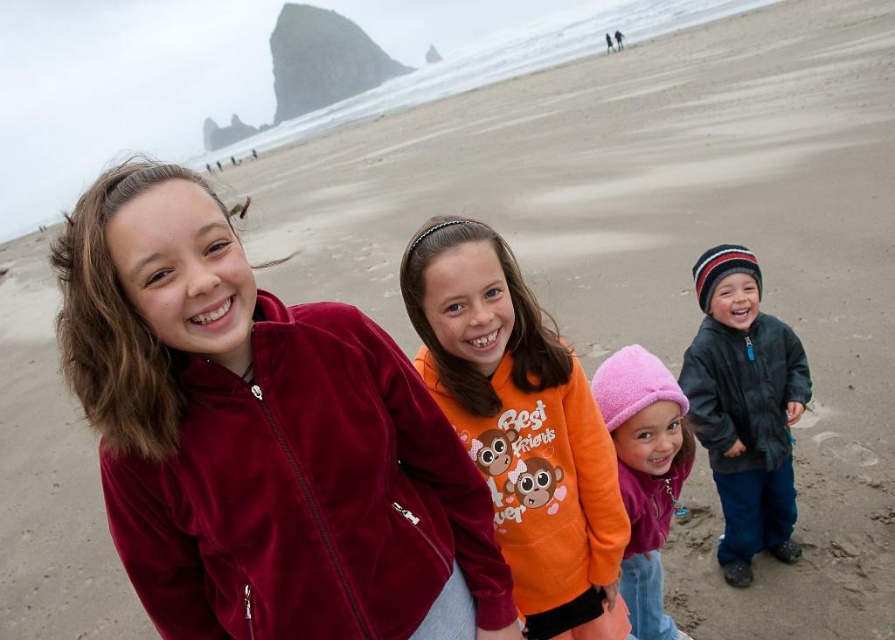
Question: Observing the image, what is the correct spatial positioning of orange fleece sweatshirt at center in reference to pink fleece hat at center?

Choices:
 (A) left
 (B) right

Answer: (A)

Question: Which object is farther from the camera taking this photo?

Choices:
 (A) velvet maroon jacket at upper left
 (B) orange fleece sweatshirt at center
 (C) pink fleece hat at center
 (D) dark gray fleece jacket at lower right

Answer: (D)

Question: Which of the following is the farthest from the observer?

Choices:
 (A) dark gray fleece jacket at lower right
 (B) velvet maroon jacket at upper left
 (C) orange fleece sweatshirt at center
 (D) pink fleece hat at center

Answer: (A)

Question: Is velvet maroon jacket at upper left above pink fleece hat at center?

Choices:
 (A) yes
 (B) no

Answer: (A)

Question: Observing the image, what is the correct spatial positioning of dark gray fleece jacket at lower right in reference to pink fleece hat at center?

Choices:
 (A) above
 (B) below

Answer: (A)

Question: Which point is farther to the camera?

Choices:
 (A) velvet maroon jacket at upper left
 (B) pink fleece hat at center

Answer: (B)